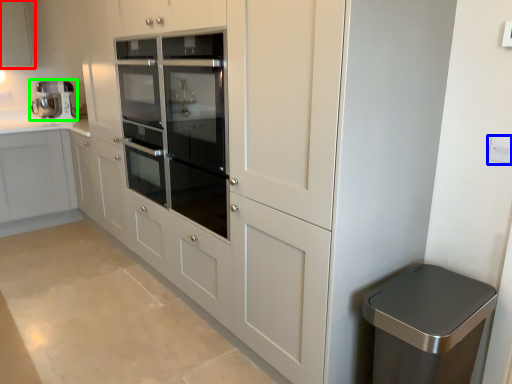
Question: Which object is the farthest from cabinetry (highlighted by a red box)? Choose among these: electric outlet (highlighted by a blue box) or home appliance (highlighted by a green box).

Choices:
 (A) electric outlet
 (B) home appliance

Answer: (A)